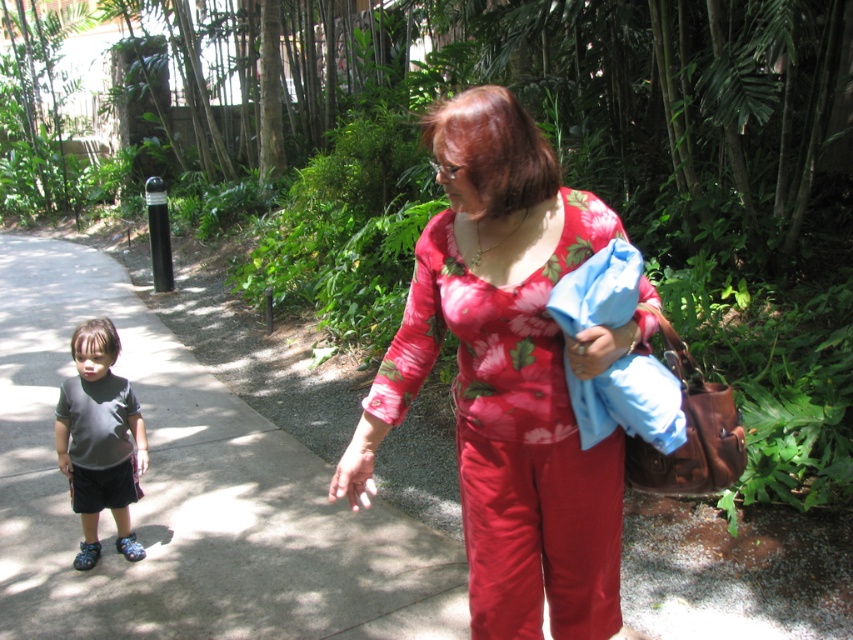
Question: Which object is positioned closest to the floral cotton blouse at center?

Choices:
 (A) gray concrete pavement at lower left
 (B) dark gray matte shirt at left

Answer: (A)

Question: Among these points, which one is nearest to the camera?

Choices:
 (A) (526, 484)
 (B) (123, 445)

Answer: (A)

Question: Is floral cotton blouse at center smaller than dark gray matte shirt at left?

Choices:
 (A) no
 (B) yes

Answer: (A)

Question: Is gray concrete pavement at lower left behind dark gray matte shirt at left?

Choices:
 (A) yes
 (B) no

Answer: (B)

Question: Estimate the real-world distances between objects in this image. Which object is closer to the dark gray matte shirt at left?

Choices:
 (A) floral cotton blouse at center
 (B) gray concrete pavement at lower left

Answer: (B)

Question: Is gray concrete pavement at lower left bigger than dark gray matte shirt at left?

Choices:
 (A) yes
 (B) no

Answer: (A)